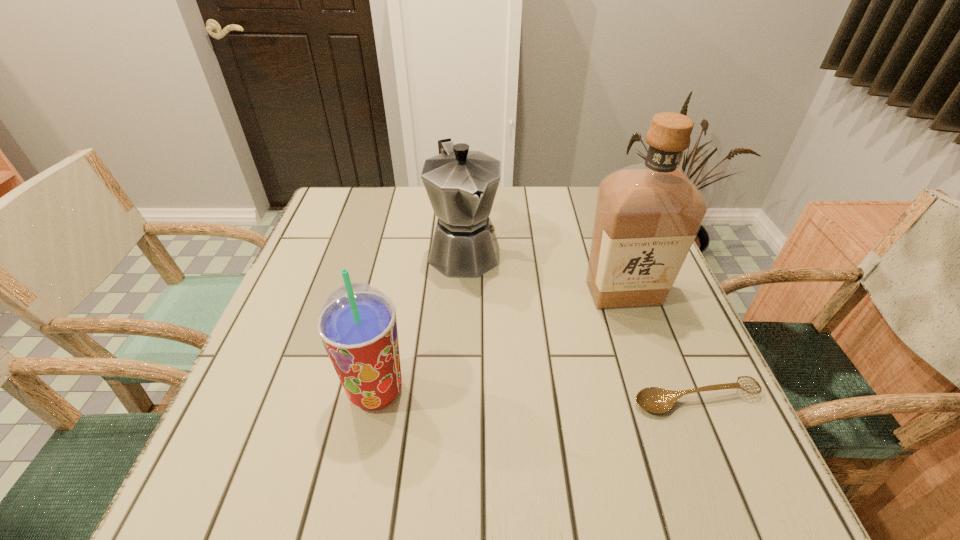
Identify the location of vacant space on the desktop that is between the smoothie and the shortest object and is positioned at the spout of the third object from right to left. The height and width of the screenshot is (540, 960). (542, 395).

Locate an element on the screen. The width and height of the screenshot is (960, 540). free spot on the desktop that is between the smoothie and the shortest object and is positioned on the front-facing side of the tallest object is located at coordinates (581, 396).